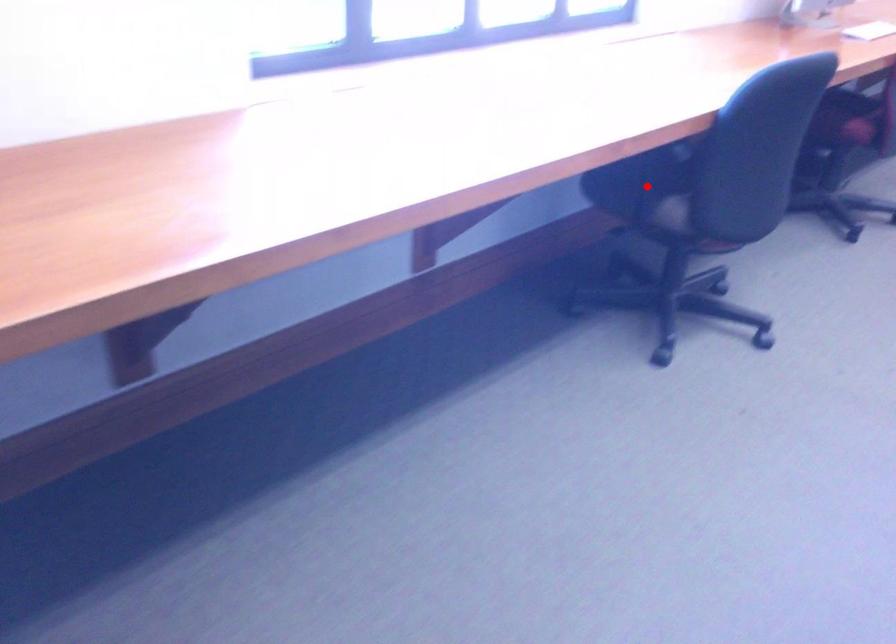
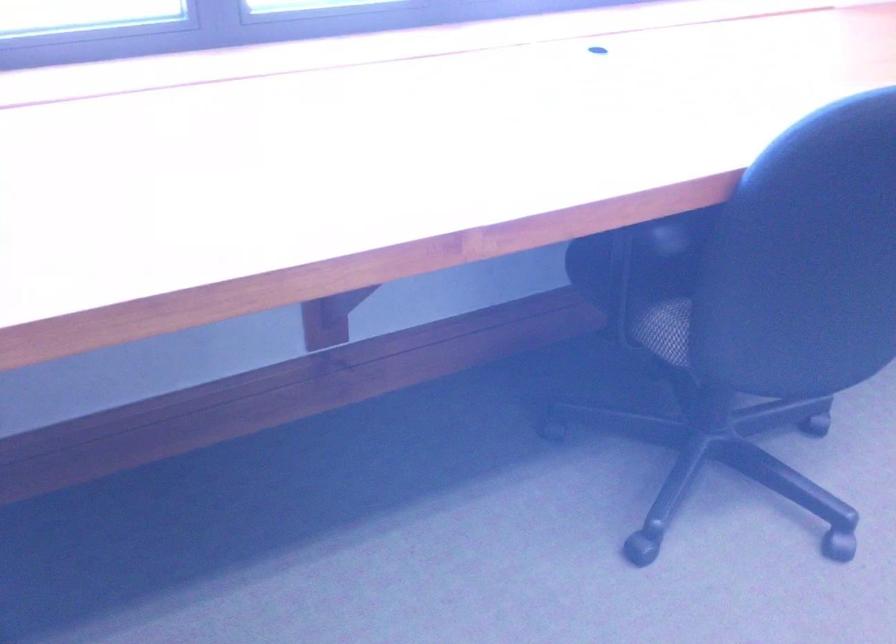
In the second image, find the point that corresponds to the highlighted location in the first image.

(645, 279)